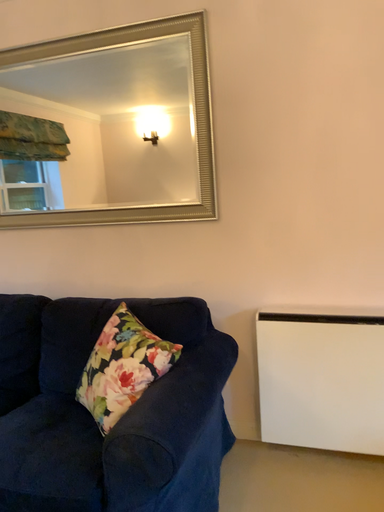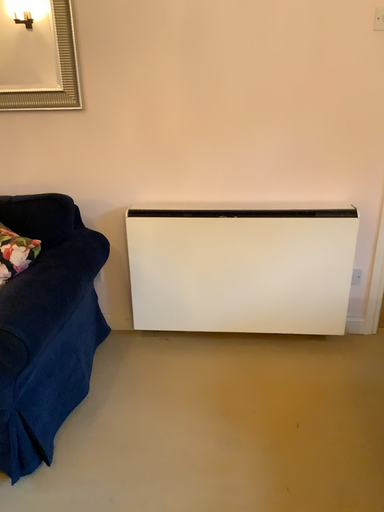
Question: How did the camera likely rotate when shooting the video?

Choices:
 (A) rotated left
 (B) rotated right

Answer: (B)